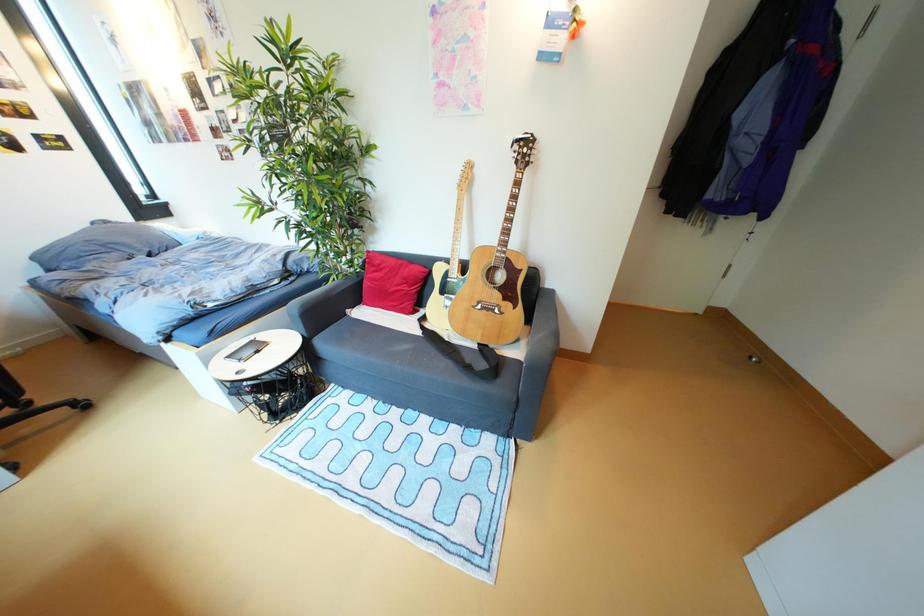
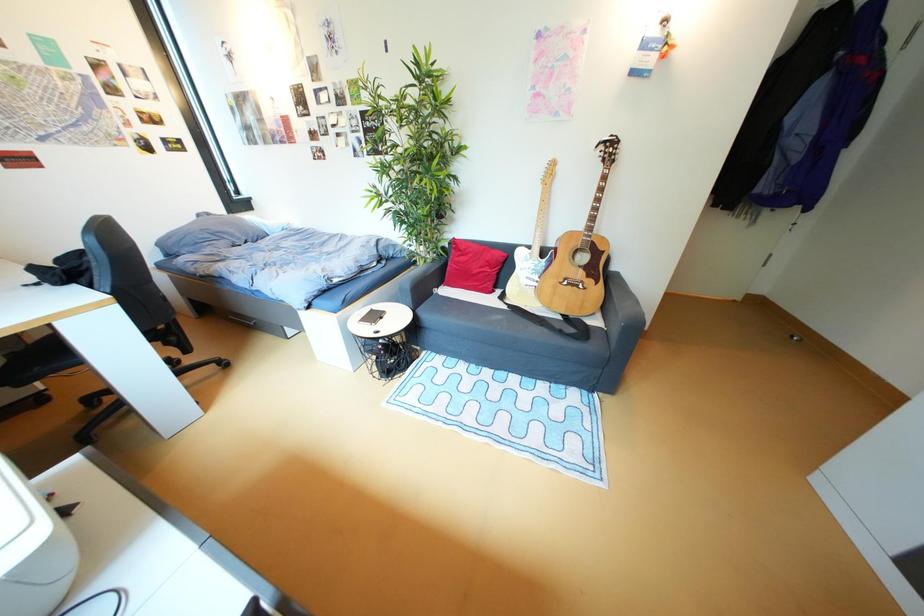
What movement of the cameraman would produce the second image?

The cameraman walked toward left, backward.